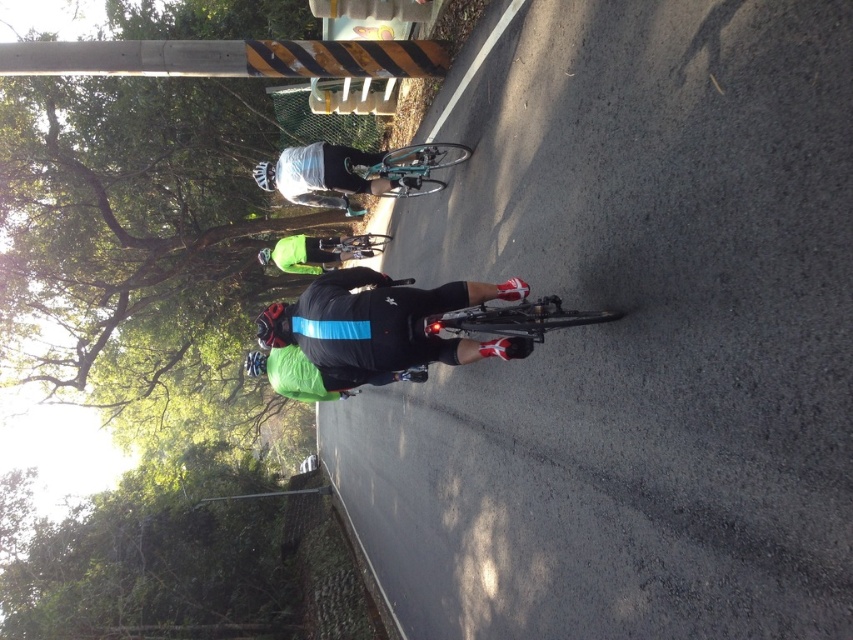
What do you see at coordinates (380, 324) in the screenshot? This screenshot has width=853, height=640. I see `black matte cycling suit at center` at bounding box center [380, 324].

Image resolution: width=853 pixels, height=640 pixels. I want to click on black matte cycling suit at center, so click(380, 324).

Who is more forward, (309, 320) or (300, 170)?

Point (309, 320) is in front.

This screenshot has height=640, width=853. I want to click on black matte cycling suit at center, so click(380, 324).

Does point (354, 273) come farther from viewer compared to point (279, 260)?

No, (354, 273) is closer to viewer.

Which is more to the right, black matte cycling suit at center or green matte jacket at center?

black matte cycling suit at center is more to the right.

Is point (398, 355) more distant than point (329, 250)?

No, (398, 355) is closer to viewer.

Find the location of `black matte cycling suit at center`. black matte cycling suit at center is located at coordinates (380, 324).

How much distance is there between teal glossy bicycle at center and black matte bicycle helmet at center?

teal glossy bicycle at center and black matte bicycle helmet at center are 1.55 meters apart from each other.

Describe the element at coordinates (416, 166) in the screenshot. The image size is (853, 640). I see `teal glossy bicycle at center` at that location.

Who is more distant from viewer, (x=390, y=177) or (x=260, y=163)?

The point (x=260, y=163) is behind.

Locate an element on the screen. Image resolution: width=853 pixels, height=640 pixels. teal glossy bicycle at center is located at coordinates (416, 166).